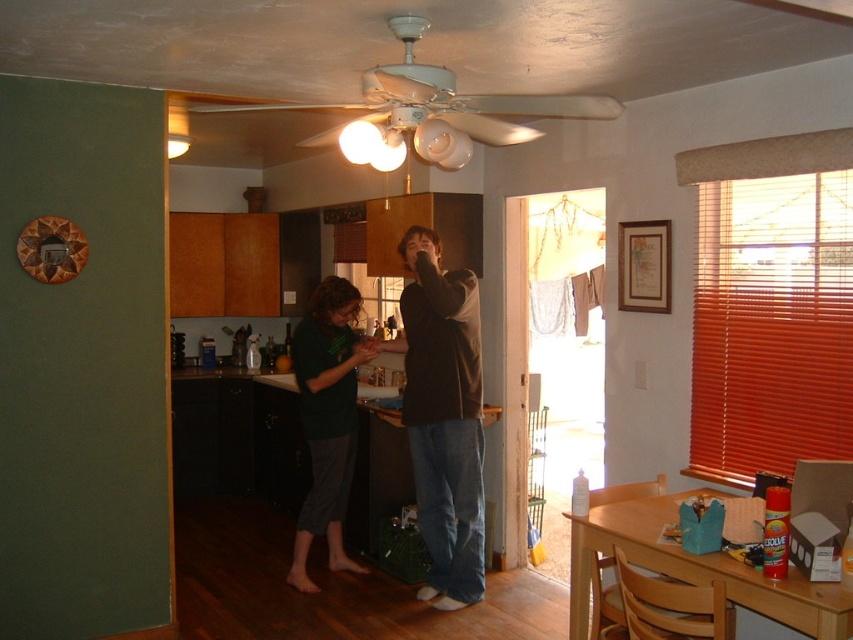
Is brown cotton shirt at center bigger than white plastic fan at upper center?

No.

Who is more forward, (460, 349) or (608, 109)?

Point (608, 109) is more forward.

The height and width of the screenshot is (640, 853). Find the location of `brown cotton shirt at center`. brown cotton shirt at center is located at coordinates (444, 419).

This screenshot has width=853, height=640. What do you see at coordinates (444, 417) in the screenshot? I see `dark green fabric shirt at center` at bounding box center [444, 417].

Is dark green fabric shirt at center shorter than white plastic fan at upper center?

No, dark green fabric shirt at center is not shorter than white plastic fan at upper center.

The image size is (853, 640). Describe the element at coordinates (444, 417) in the screenshot. I see `dark green fabric shirt at center` at that location.

This screenshot has width=853, height=640. In order to click on dark green fabric shirt at center in this screenshot , I will do `click(444, 417)`.

Who is taller, white plastic fan at upper center or green matte shirt at center?

With more height is green matte shirt at center.

You are a GUI agent. You are given a task and a screenshot of the screen. Output one action in this format:
    pyautogui.click(x=<x>, y=<y>)
    Task: Click on the white plastic fan at upper center
    This screenshot has height=640, width=853.
    Given the screenshot: What is the action you would take?
    pyautogui.click(x=428, y=113)

Which is in front, point (454, 99) or point (331, 460)?

Point (454, 99)

Image resolution: width=853 pixels, height=640 pixels. What are the coordinates of `white plastic fan at upper center` in the screenshot? It's located at (428, 113).